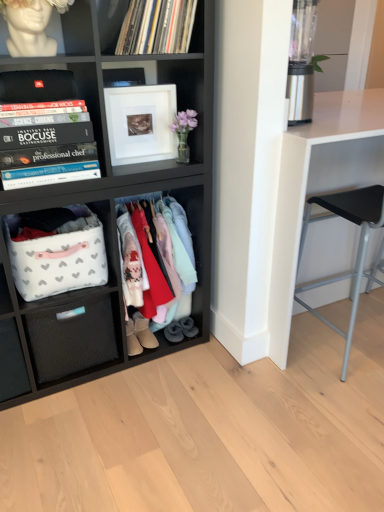
At what (x,y) coordinates should I click in order to perform the action: click on free location in front of dark gray suede slippers at lower center, which is the 2th footwear in right-to-left order. Please return your answer as a coordinate pair (x, y). Image resolution: width=384 pixels, height=512 pixels. Looking at the image, I should click on (157, 352).